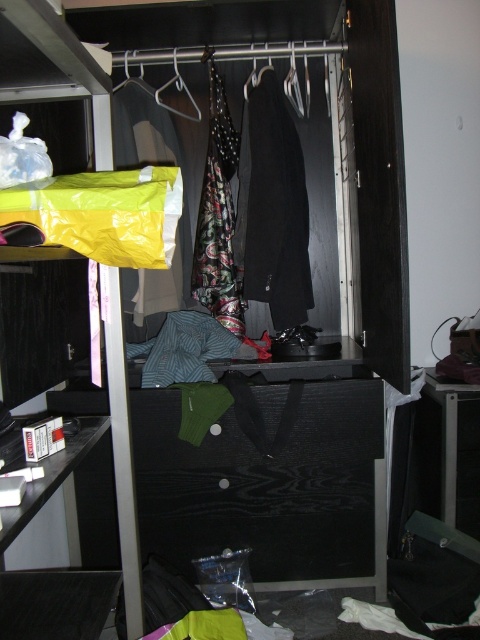
You are trying to organize your closet and need to place a new accessory between the printed silk scarf at center and the metallic silver hanger at center. The accessory requires 14 inches of space. Is there enough space between them?

The printed silk scarf at center and metallic silver hanger at center are 12.89 inches apart from each other. Since the accessory needs 14 inches, there is not enough space between them to fit the accessory.

You are trying to organize the closet and need to know if the printed silk scarf at center can fit vertically in the space currently occupied by the metallic silver hanger at center. Can it?

The printed silk scarf at center is much taller than the metallic silver hanger at center, so it cannot fit vertically in that space.

You are organizing the closet and need to place a new item on the shelf. The shelf is located at the left side of the image. There is a point marked at coordinates (276, 211). What is the object at this point?

The point at coordinates (276, 211) marks the black wool coat at center.